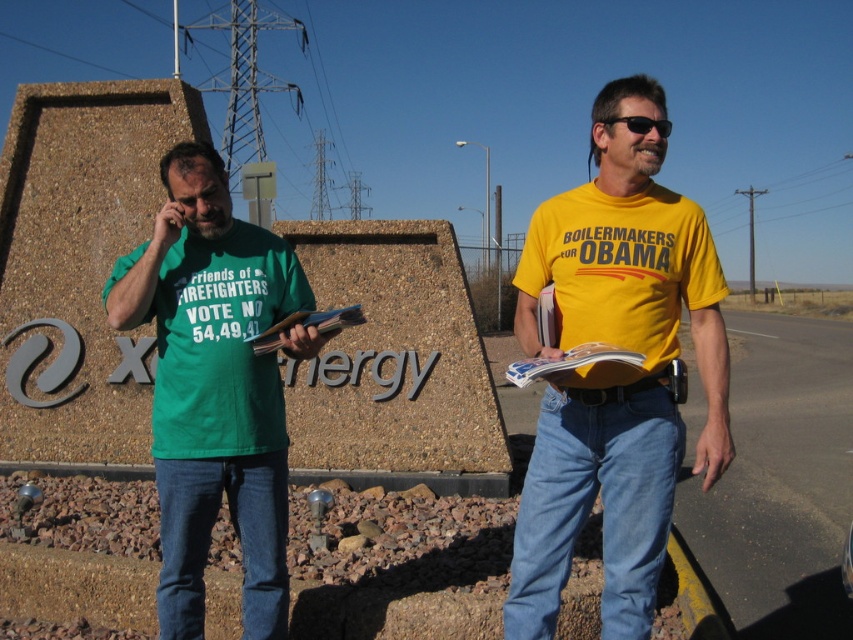
You are standing at the point marked by coordinates point (177, 189). You want to take a photo of the large sign that reads

The point marked by coordinates point (177, 189) is 9.79 feet away from the camera, so you can take a photo of the large sign from there.